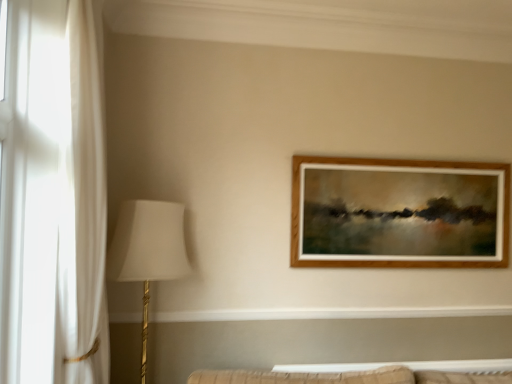
You are a GUI agent. You are given a task and a screenshot of the screen. Output one action in this format:
    pyautogui.click(x=<x>, y=<y>)
    Task: Click on the white smooth window sill at lower center
    The image size is (512, 384).
    Given the screenshot: What is the action you would take?
    (x=328, y=313)

The width and height of the screenshot is (512, 384). What do you see at coordinates (328, 313) in the screenshot? I see `white smooth window sill at lower center` at bounding box center [328, 313].

Image resolution: width=512 pixels, height=384 pixels. In order to click on white smooth window sill at lower center in this screenshot , I will do `click(328, 313)`.